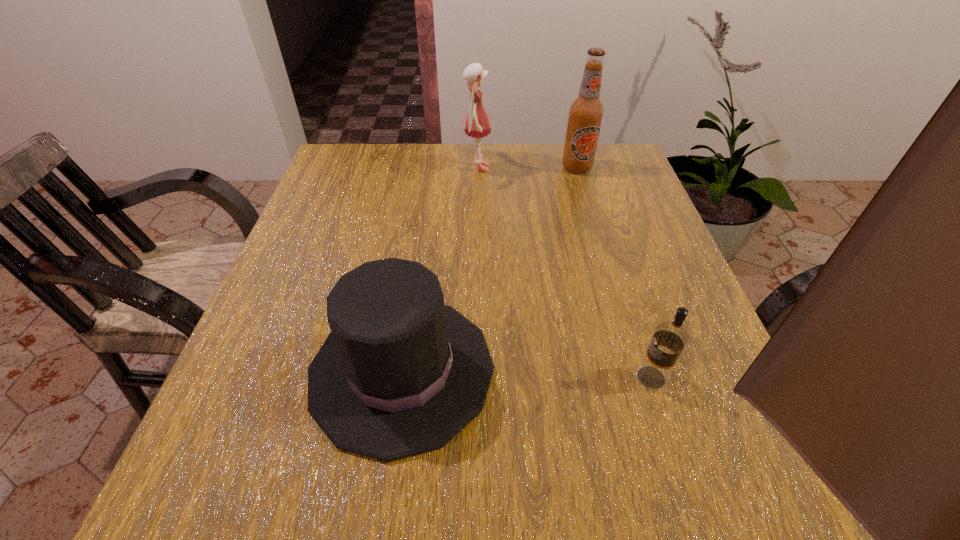
Where is `beer bottle located at the far edge`? beer bottle located at the far edge is located at coordinates (585, 114).

Where is `doll that is at the far edge`? The height and width of the screenshot is (540, 960). doll that is at the far edge is located at coordinates (477, 123).

Where is `object located at the near edge`? This screenshot has height=540, width=960. object located at the near edge is located at coordinates (400, 373).

Image resolution: width=960 pixels, height=540 pixels. I want to click on object that is at the left edge, so click(400, 373).

This screenshot has width=960, height=540. Identify the location of beer bottle located in the right edge section of the desktop. (585, 114).

Image resolution: width=960 pixels, height=540 pixels. In order to click on vodka that is at the right edge in this screenshot , I will do `click(669, 339)`.

Where is `object located in the near left corner section of the desktop`? object located in the near left corner section of the desktop is located at coordinates (400, 373).

At what (x,y) coordinates should I click in order to perform the action: click on object located in the far right corner section of the desktop. Please return your answer as a coordinate pair (x, y). The image size is (960, 540). Looking at the image, I should click on (x=585, y=114).

What are the coordinates of `free location at the far edge` in the screenshot? It's located at (554, 177).

Locate an element on the screen. The height and width of the screenshot is (540, 960). free space at the near edge of the desktop is located at coordinates (368, 482).